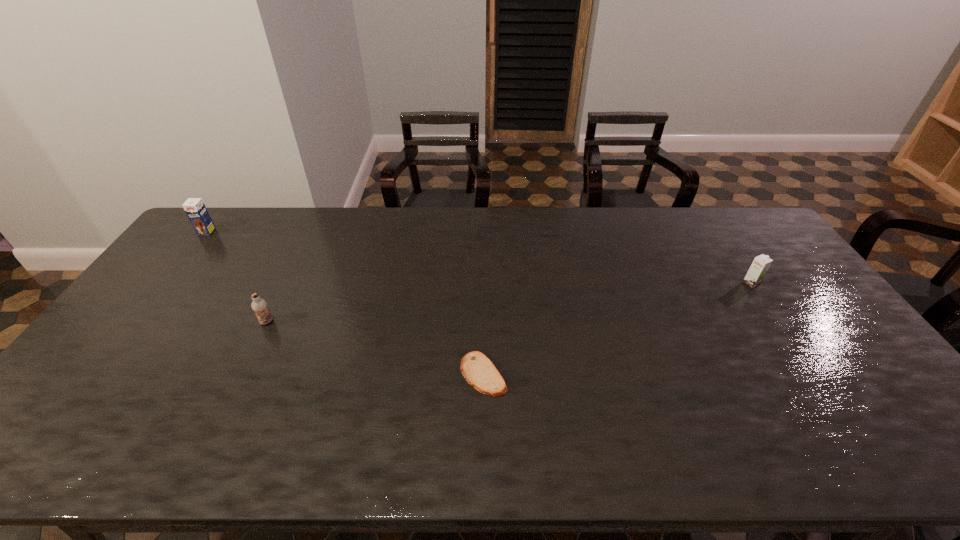
Locate an element on the screen. vacant area that lies between the pita bread and the tallest chocolate milk is located at coordinates (345, 303).

This screenshot has height=540, width=960. I want to click on object that stands as the second closest to the shortest object, so click(758, 269).

At what (x,y) coordinates should I click in order to perform the action: click on object that stands as the third closest to the third object from left to right. Please return your answer as a coordinate pair (x, y). Looking at the image, I should click on (195, 209).

The height and width of the screenshot is (540, 960). What are the coordinates of `chocolate milk that is the closest to the farthest object` in the screenshot? It's located at (259, 306).

Select which chocolate milk is the second closest to the shortest object. Please provide its 2D coordinates. Your answer should be formatted as a tuple, i.e. [(x, y)], where the tuple contains the x and y coordinates of a point satisfying the conditions above.

[(758, 269)]

What are the coordinates of `free point that satisfies the following two spatial constraints: 1. on the front label of the farthest object; 2. on the left side of the nearest object` in the screenshot? It's located at (97, 374).

Locate an element on the screen. This screenshot has height=540, width=960. free space that satisfies the following two spatial constraints: 1. on the front label of the third object from right to left; 2. on the left side of the leftmost object is located at coordinates pos(137,322).

The width and height of the screenshot is (960, 540). I want to click on free space that satisfies the following two spatial constraints: 1. on the back side of the shortest object; 2. on the right side of the second farthest chocolate milk, so click(483, 284).

The image size is (960, 540). Find the location of `free space that satisfies the following two spatial constraints: 1. on the back side of the rightmost chocolate milk; 2. on the right side of the third object from left to right`. free space that satisfies the following two spatial constraints: 1. on the back side of the rightmost chocolate milk; 2. on the right side of the third object from left to right is located at coordinates (483, 284).

This screenshot has height=540, width=960. I want to click on vacant region that satisfies the following two spatial constraints: 1. on the front label of the tallest object; 2. on the left side of the third nearest object, so click(x=167, y=284).